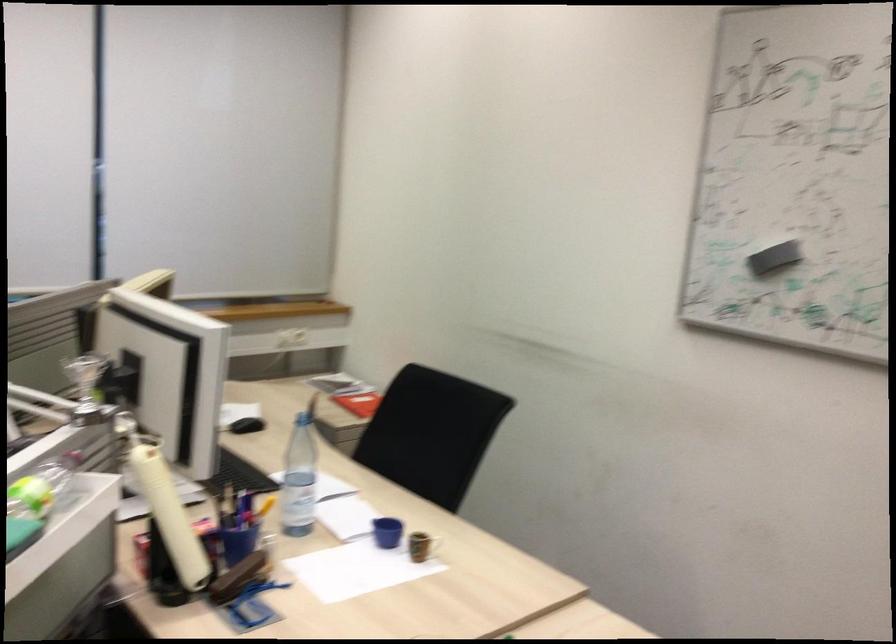
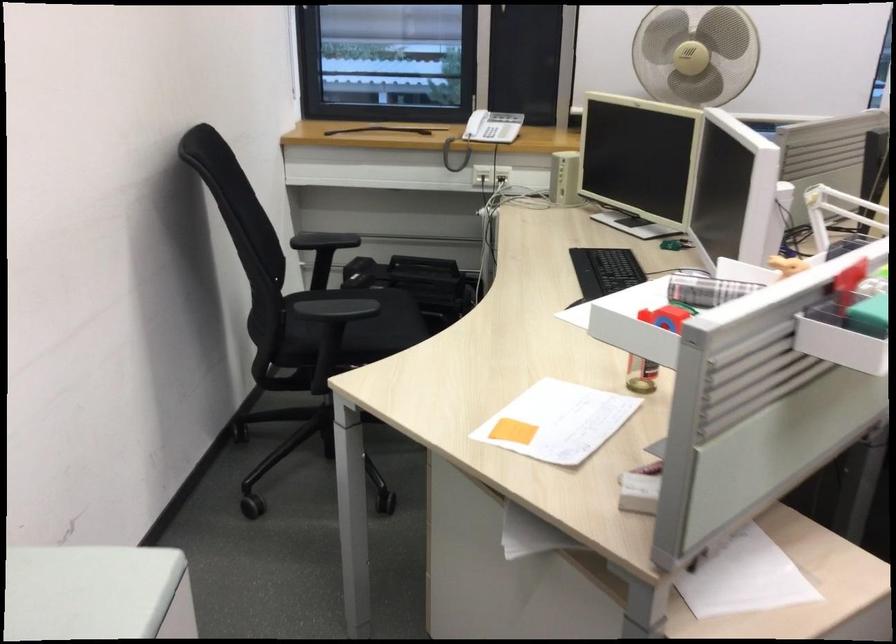
Question: The camera is either moving clockwise (left) or counter-clockwise (right) around the object. The first image is from the beginning of the video and the second image is from the end. Is the camera moving left or right when shooting the video?

Choices:
 (A) Left
 (B) Right

Answer: (B)